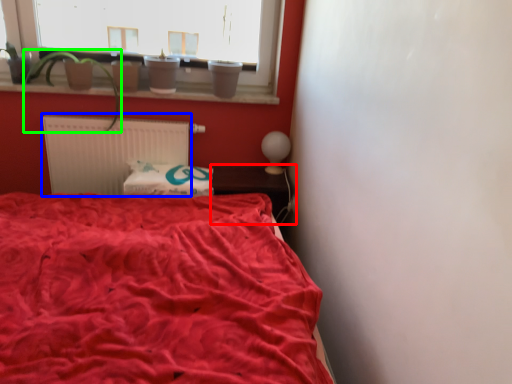
Question: Based on their relative distances, which object is nearer to table (highlighted by a red box)? Choose from radiator (highlighted by a blue box) and plant (highlighted by a green box).

Choices:
 (A) radiator
 (B) plant

Answer: (A)